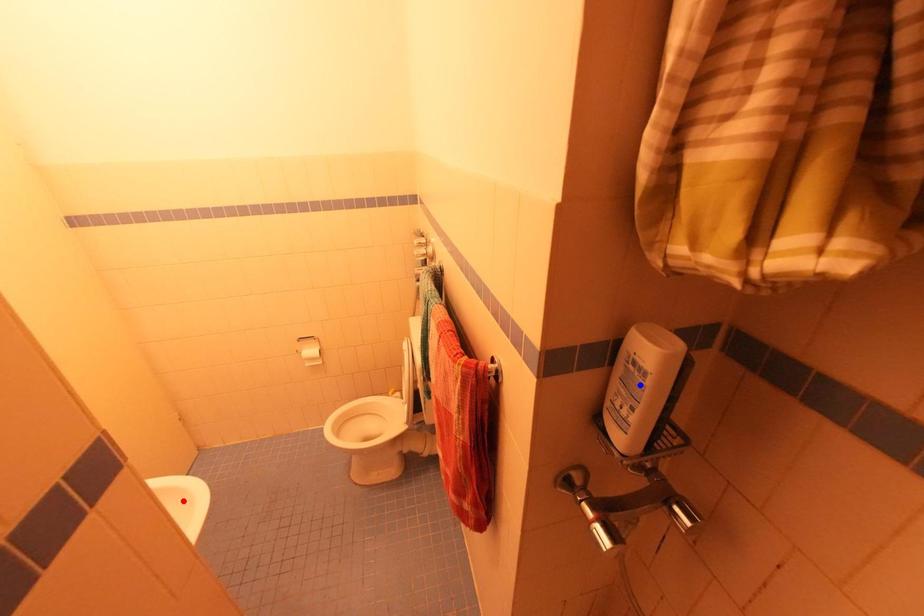
Question: In the image, two points are highlighted. Which point is nearer to the camera? Reply with the corresponding letter.

Choices:
 (A) blue point
 (B) red point

Answer: (A)